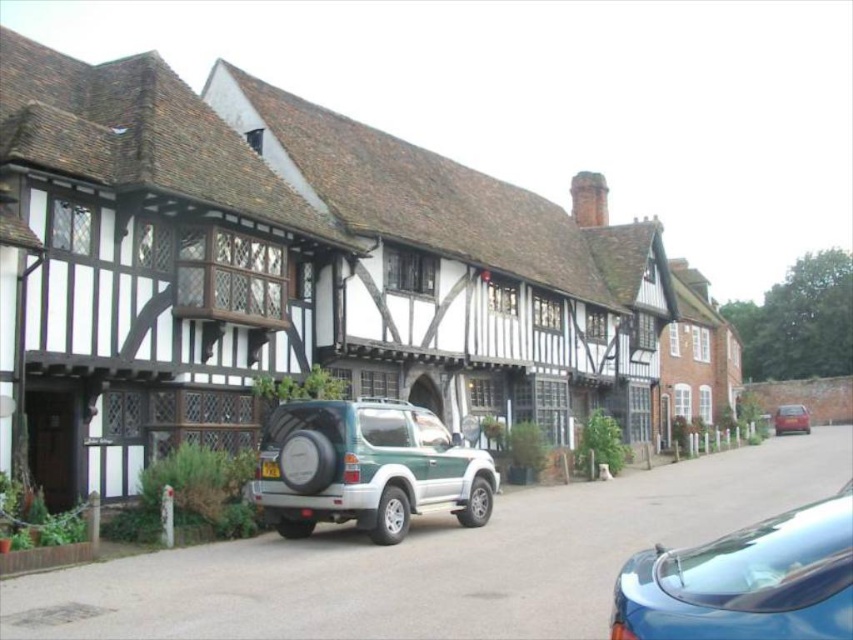
Question: Does green matte suv at center appear on the left side of black plastic license plate at center?

Choices:
 (A) yes
 (B) no

Answer: (B)

Question: Can you confirm if glossy blue car at lower right is positioned above black plastic license plate at center?

Choices:
 (A) no
 (B) yes

Answer: (A)

Question: Among these points, which one is nearest to the camera?

Choices:
 (A) (276, 476)
 (B) (833, 624)

Answer: (B)

Question: Which point is farther from the camera taking this photo?

Choices:
 (A) (267, 467)
 (B) (721, 612)
 (C) (339, 456)

Answer: (A)

Question: In this image, where is matte red car at center located relative to black plastic license plate at center?

Choices:
 (A) left
 (B) right

Answer: (B)

Question: Among these objects, which one is nearest to the camera?

Choices:
 (A) black plastic license plate at center
 (B) matte red car at center

Answer: (A)